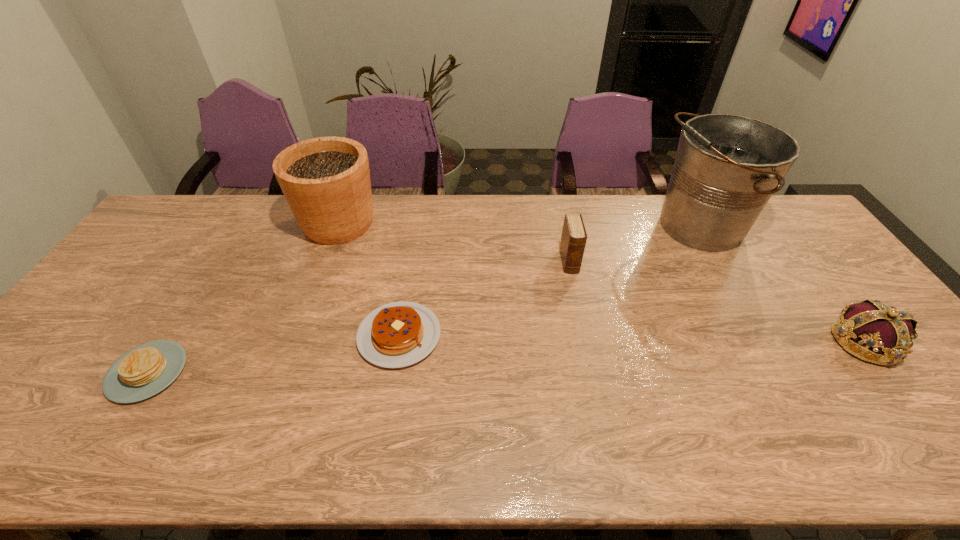
The height and width of the screenshot is (540, 960). Identify the location of bucket. (727, 166).

Where is `the tallest object`? the tallest object is located at coordinates (727, 166).

You are a GUI agent. You are given a task and a screenshot of the screen. Output one action in this format:
    pyautogui.click(x=<x>, y=<y>)
    Task: Click on the flowerpot
    This screenshot has width=960, height=540.
    Given the screenshot: What is the action you would take?
    pyautogui.click(x=326, y=181)

The width and height of the screenshot is (960, 540). Identify the location of the second object from left to right. (326, 181).

At what (x,y) coordinates should I click in order to perform the action: click on the third object from right to left. Please return your answer as a coordinate pair (x, y). The width and height of the screenshot is (960, 540). Looking at the image, I should click on (574, 236).

Identify the location of the rightmost object. The image size is (960, 540). (884, 334).

At what (x,y) coordinates should I click in order to perform the action: click on the fourth object from right to left. Please return your answer as a coordinate pair (x, y). Looking at the image, I should click on (399, 334).

Locate an element on the screen. Image resolution: width=960 pixels, height=540 pixels. the leftmost object is located at coordinates (144, 371).

Locate an element on the screen. This screenshot has width=960, height=540. free space located 0.130m on the front of the bucket is located at coordinates (738, 295).

The image size is (960, 540). I want to click on free point located on the left of the flowerpot, so click(233, 224).